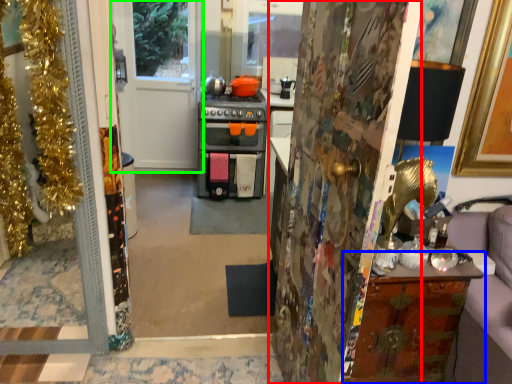
Question: Considering the real-world distances, which object is farthest from door (highlighted by a red box)? cabinetry (highlighted by a blue box) or door (highlighted by a green box)?

Choices:
 (A) cabinetry
 (B) door

Answer: (B)